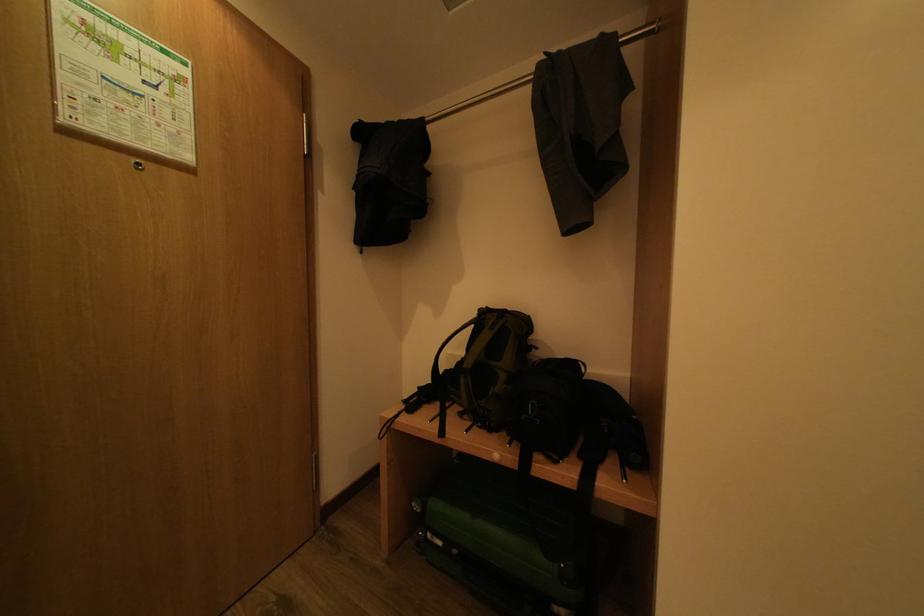
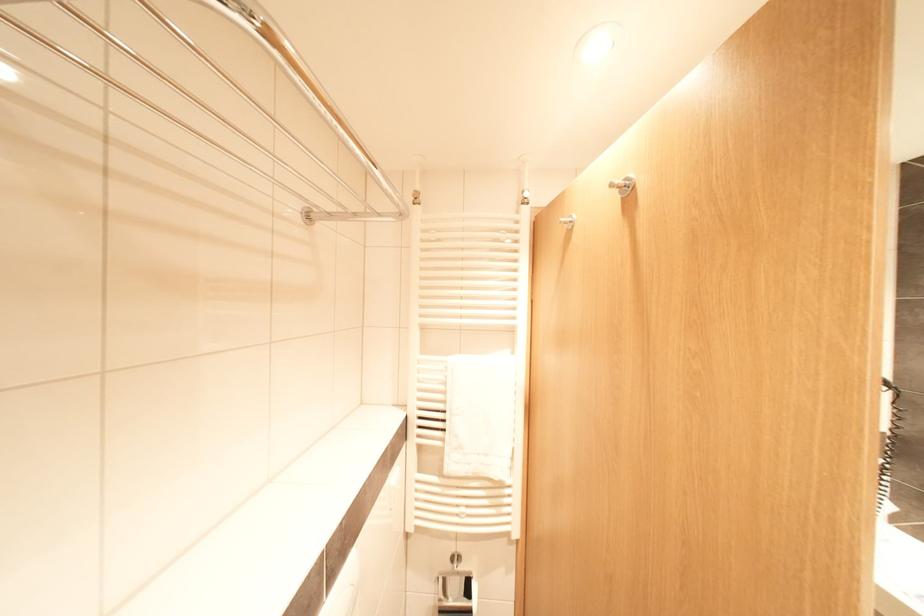
In a continuous first-person perspective shot, in which direction is the camera moving?

The cameraman moved toward left, backward.